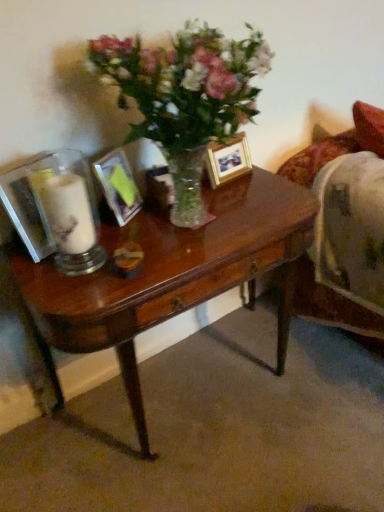
Identify the location of vacant space in front of white matte candle at left. The width and height of the screenshot is (384, 512). (52, 274).